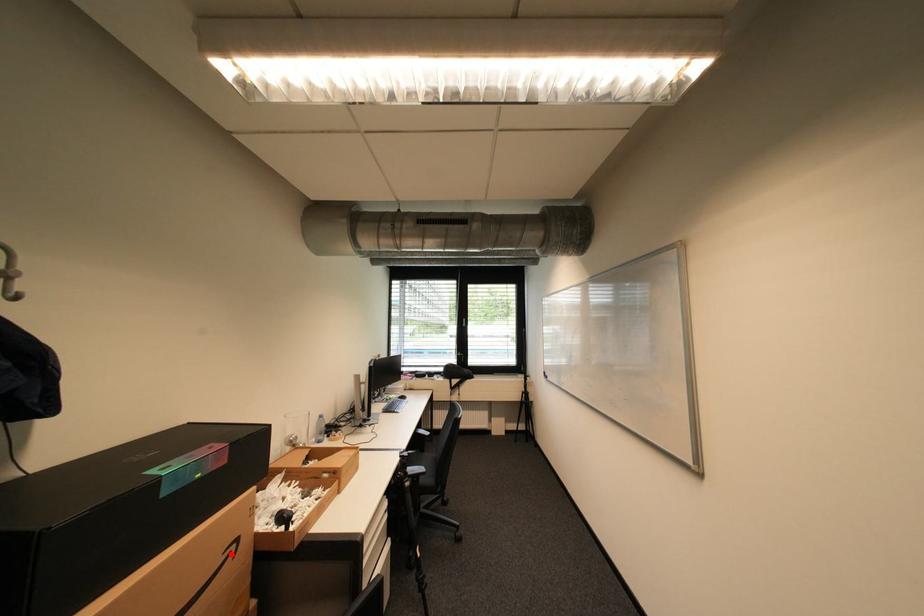
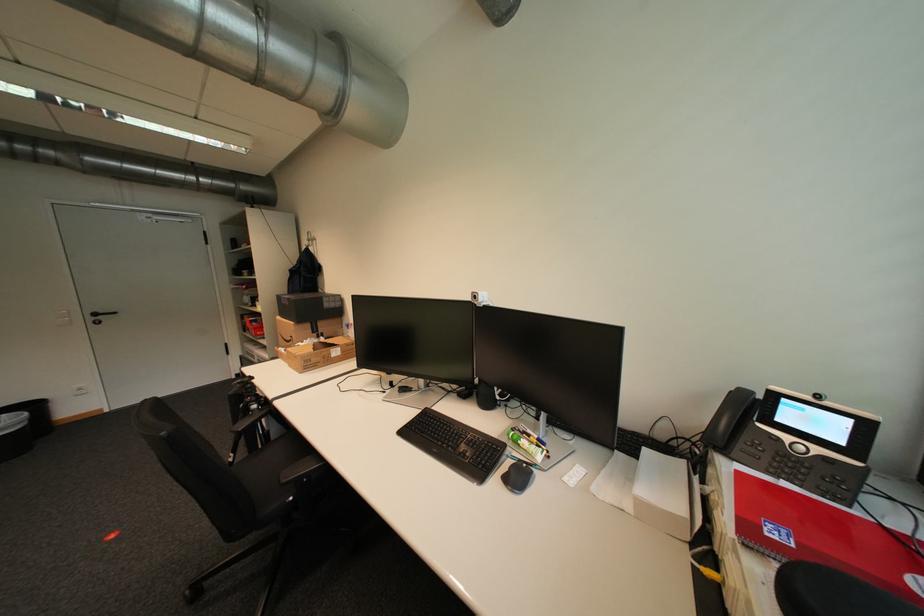
The point at the highlighted location is marked in the first image. Where is the corresponding point in the second image?

(299, 338)